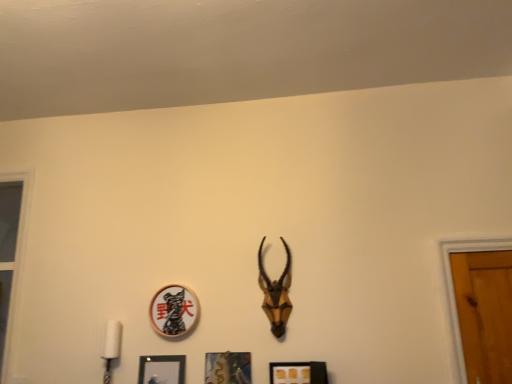
Question: Can you confirm if metallic silver picture frame at center, marked as the 2th picture frame in a right-to-left arrangement, is taller than matte gold picture frame at lower center, which appears as the 4th picture frame when viewed from the left?

Choices:
 (A) no
 (B) yes

Answer: (B)

Question: Considering the relative sizes of metallic silver picture frame at center, marked as the 2th picture frame in a right-to-left arrangement, and matte gold picture frame at lower center, which appears as the 4th picture frame when viewed from the left, in the image provided, is metallic silver picture frame at center, marked as the 2th picture frame in a right-to-left arrangement, wider than matte gold picture frame at lower center, which appears as the 4th picture frame when viewed from the left,?

Choices:
 (A) yes
 (B) no

Answer: (B)

Question: Is metallic silver picture frame at center, marked as the 2th picture frame in a right-to-left arrangement, positioned before matte gold picture frame at lower center, which appears as the 4th picture frame when viewed from the left?

Choices:
 (A) yes
 (B) no

Answer: (B)

Question: Considering the relative sizes of metallic silver picture frame at center, the third picture frame in the left-to-right sequence, and matte gold picture frame at lower center, which appears as the 4th picture frame when viewed from the left, in the image provided, is metallic silver picture frame at center, the third picture frame in the left-to-right sequence, smaller than matte gold picture frame at lower center, which appears as the 4th picture frame when viewed from the left,?

Choices:
 (A) yes
 (B) no

Answer: (B)

Question: Can matte gold picture frame at lower center, which appears as the 4th picture frame when viewed from the left, be found inside metallic silver picture frame at center, marked as the 2th picture frame in a right-to-left arrangement?

Choices:
 (A) no
 (B) yes

Answer: (A)

Question: From a real-world perspective, is black matte picture frame at lower center, marked as the 4th picture frame in a right-to-left arrangement, above or below matte gold picture frame at lower center, which appears as the 4th picture frame when viewed from the left?

Choices:
 (A) below
 (B) above

Answer: (B)

Question: In terms of height, does black matte picture frame at lower center, marked as the 4th picture frame in a right-to-left arrangement, look taller or shorter compared to matte gold picture frame at lower center, the first picture frame in the right-to-left sequence?

Choices:
 (A) short
 (B) tall

Answer: (B)

Question: Looking at their shapes, would you say black matte picture frame at lower center, acting as the first picture frame starting from the left, is wider or thinner than matte gold picture frame at lower center, which appears as the 4th picture frame when viewed from the left?

Choices:
 (A) wide
 (B) thin

Answer: (A)

Question: Visually, is black matte picture frame at lower center, marked as the 4th picture frame in a right-to-left arrangement, positioned to the left or to the right of matte gold picture frame at lower center, the first picture frame in the right-to-left sequence?

Choices:
 (A) left
 (B) right

Answer: (A)

Question: Is metallic silver picture frame at center, marked as the 2th picture frame in a right-to-left arrangement, spatially inside brown matte antelope head at center, or outside of it?

Choices:
 (A) outside
 (B) inside

Answer: (A)

Question: Is metallic silver picture frame at center, the third picture frame in the left-to-right sequence, in front of or behind brown matte antelope head at center in the image?

Choices:
 (A) front
 (B) behind

Answer: (A)

Question: Is metallic silver picture frame at center, the third picture frame in the left-to-right sequence, taller or shorter than brown matte antelope head at center?

Choices:
 (A) tall
 (B) short

Answer: (B)

Question: From a real-world perspective, relative to brown matte antelope head at center, is metallic silver picture frame at center, marked as the 2th picture frame in a right-to-left arrangement, vertically above or below?

Choices:
 (A) below
 (B) above

Answer: (A)

Question: From a real-world perspective, is matte gold picture frame at lower center, which appears as the 4th picture frame when viewed from the left, positioned above or below wooden circle at center, arranged as the second picture frame when viewed from the left?

Choices:
 (A) above
 (B) below

Answer: (B)

Question: Considering their positions, is matte gold picture frame at lower center, the first picture frame in the right-to-left sequence, located in front of or behind wooden circle at center, arranged as the second picture frame when viewed from the left?

Choices:
 (A) front
 (B) behind

Answer: (A)